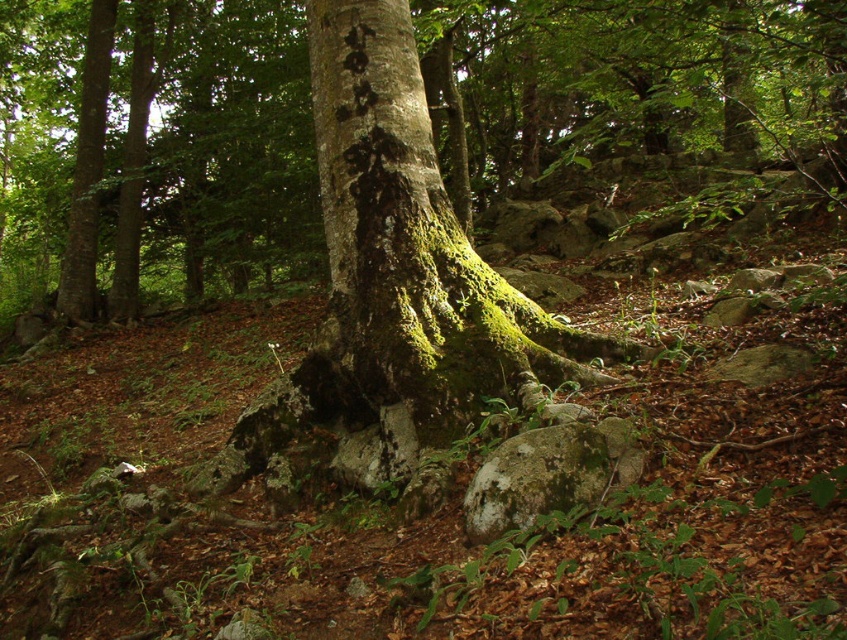
You are a hiker who has stumbled upon this forest scene. You notice the green mossy tree trunk at center and the green mossy bark at center. How far apart are these two features?

The green mossy tree trunk at center and the green mossy bark at center are 20.10 feet apart from each other.